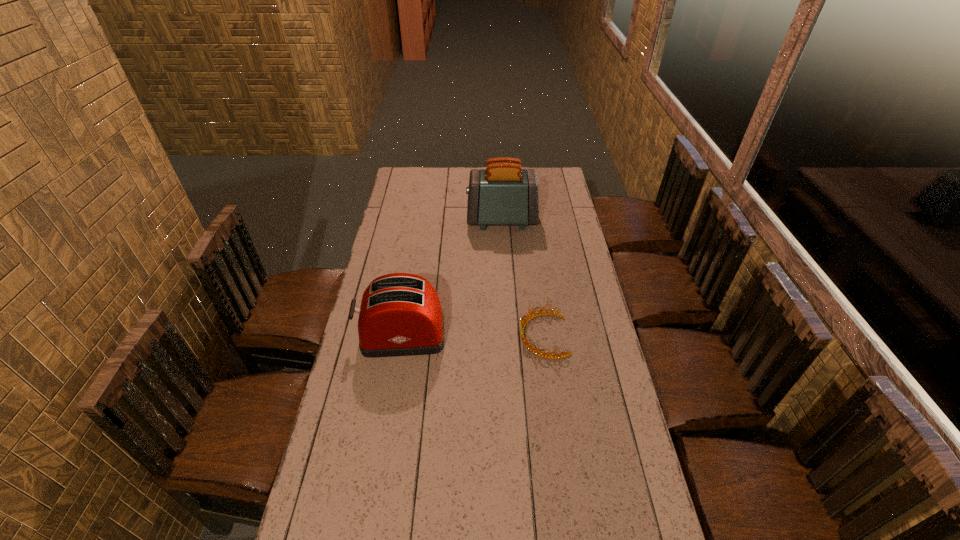
This screenshot has height=540, width=960. What are the coordinates of `empty space that is in between the second shortest object and the shortest object` in the screenshot? It's located at (472, 335).

I want to click on free space between the shortest object and the farther toaster, so click(522, 278).

At what (x,y) coordinates should I click in order to perform the action: click on blank region between the shorter toaster and the taller toaster. Please return your answer as a coordinate pair (x, y). Looking at the image, I should click on (451, 278).

The height and width of the screenshot is (540, 960). I want to click on unoccupied position between the shortest object and the nearer toaster, so click(x=472, y=335).

In order to click on object that is the second closest to the second tallest object in this screenshot , I will do `click(502, 194)`.

Locate which object ranks second in proximity to the leftmost object. Please provide its 2D coordinates. Your answer should be formatted as a tuple, i.e. [(x, y)], where the tuple contains the x and y coordinates of a point satisfying the conditions above.

[(502, 194)]